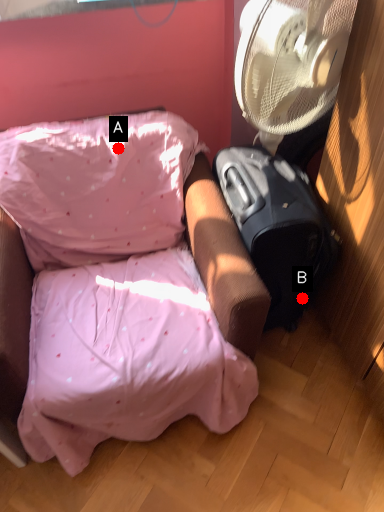
Question: Two points are circled on the image, labeled by A and B beside each circle. Which of the following is the closest to the observer?

Choices:
 (A) A is closer
 (B) B is closer

Answer: (A)